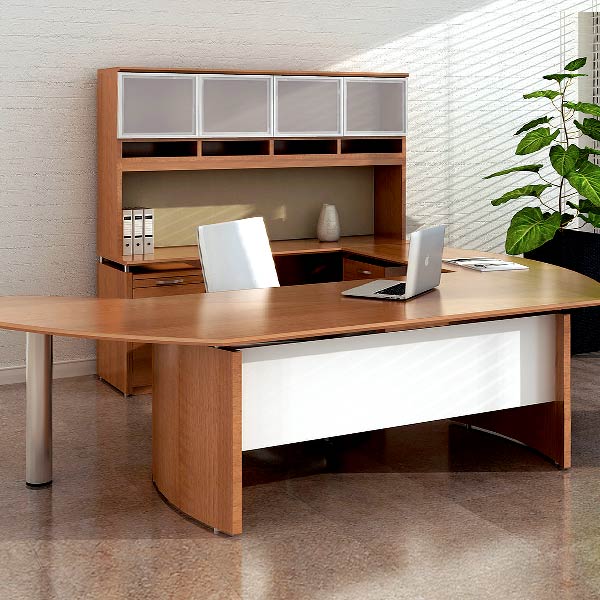
Find the location of a particular element. places to sit is located at coordinates (242, 258).